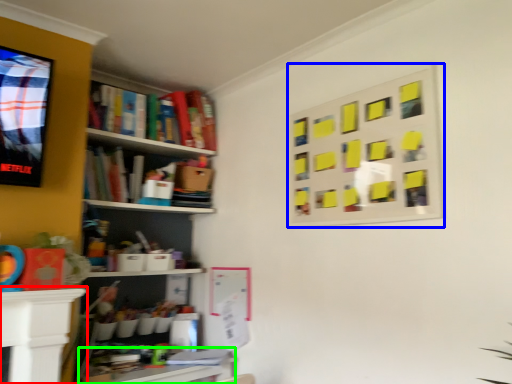
Question: Based on their relative distances, which object is nearer to table (highlighted by a red box)? Choose from bulletin board (highlighted by a blue box) and table (highlighted by a green box).

Choices:
 (A) bulletin board
 (B) table

Answer: (B)